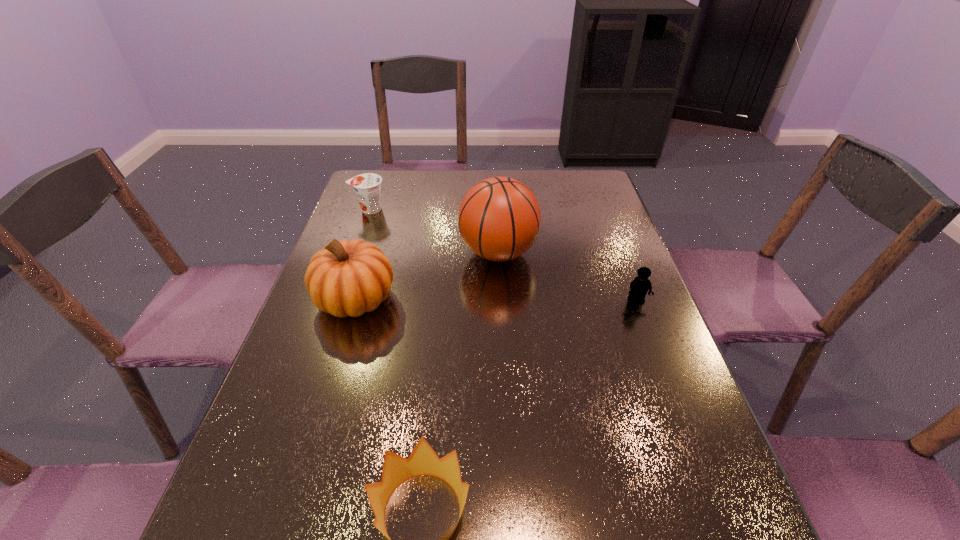
At what (x,y) coordinates should I click in order to perform the action: click on basketball. Please return your answer as a coordinate pair (x, y). This screenshot has height=540, width=960. Looking at the image, I should click on (499, 219).

I want to click on the fourth shortest object, so click(346, 278).

Image resolution: width=960 pixels, height=540 pixels. I want to click on the farthest object, so click(367, 186).

Locate an element on the screen. The width and height of the screenshot is (960, 540). the rightmost object is located at coordinates (640, 285).

Where is `blank space located on the back of the basketball`? The image size is (960, 540). blank space located on the back of the basketball is located at coordinates (495, 200).

You are a GUI agent. You are given a task and a screenshot of the screen. Output one action in this format:
    pyautogui.click(x=<x>, y=<y>)
    Task: Click on the free spot located 0.270m on the right of the fourth shortest object
    
    Given the screenshot: What is the action you would take?
    pyautogui.click(x=501, y=299)

Where is `vacant space situated on the back of the farthest object`? The height and width of the screenshot is (540, 960). vacant space situated on the back of the farthest object is located at coordinates (376, 187).

The width and height of the screenshot is (960, 540). I want to click on free location located on the front-facing side of the Lego, so click(655, 350).

Where is `object that is at the far edge`? The width and height of the screenshot is (960, 540). object that is at the far edge is located at coordinates (367, 186).

The image size is (960, 540). In order to click on pumpkin at the left edge in this screenshot , I will do (x=346, y=278).